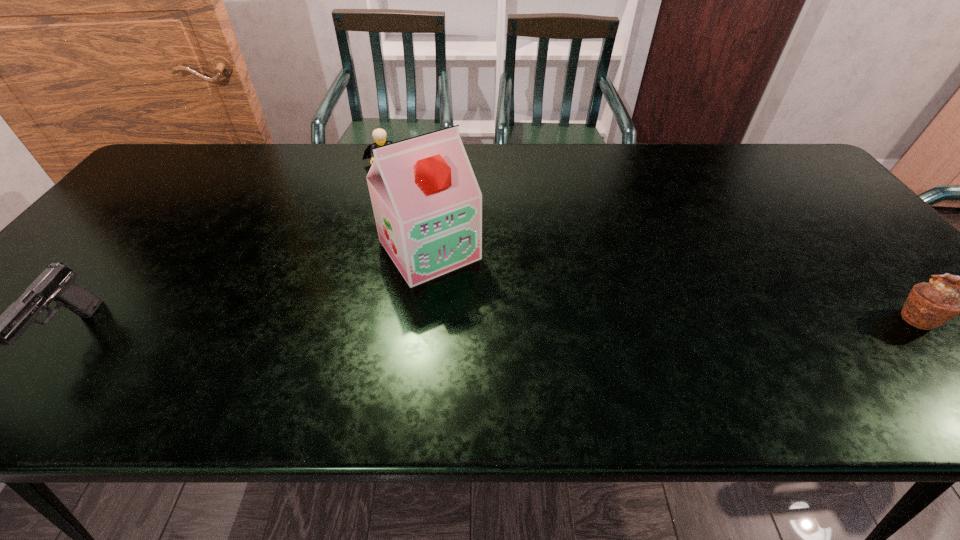
This screenshot has width=960, height=540. What are the coordinates of `vacant spot on the desktop that is between the pistol and the muffin and is positioned on the front-facing side of the Lego` in the screenshot? It's located at (442, 327).

Identify the location of free space on the desktop that is between the pistol and the muffin and is positioned with the cap open on the tallest object. The height and width of the screenshot is (540, 960). (488, 326).